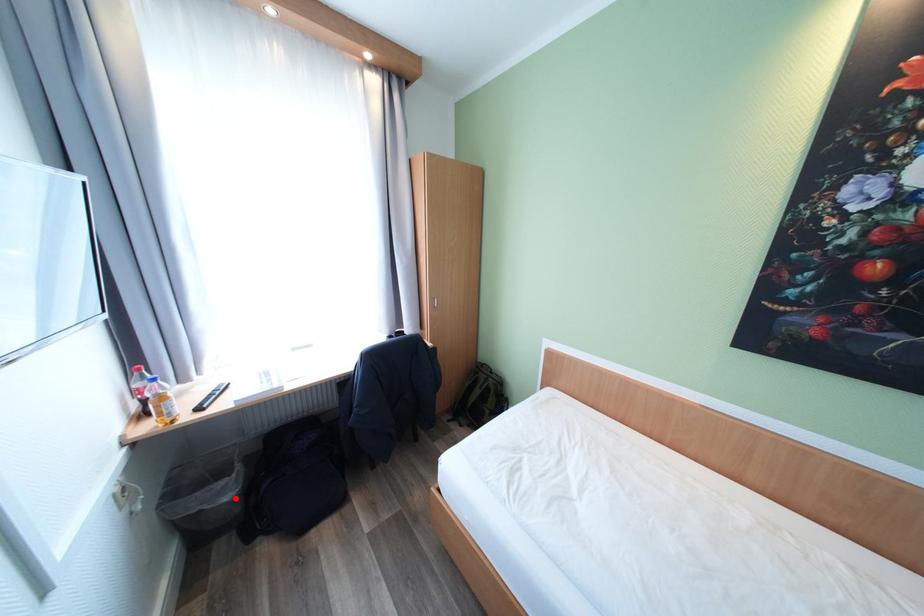
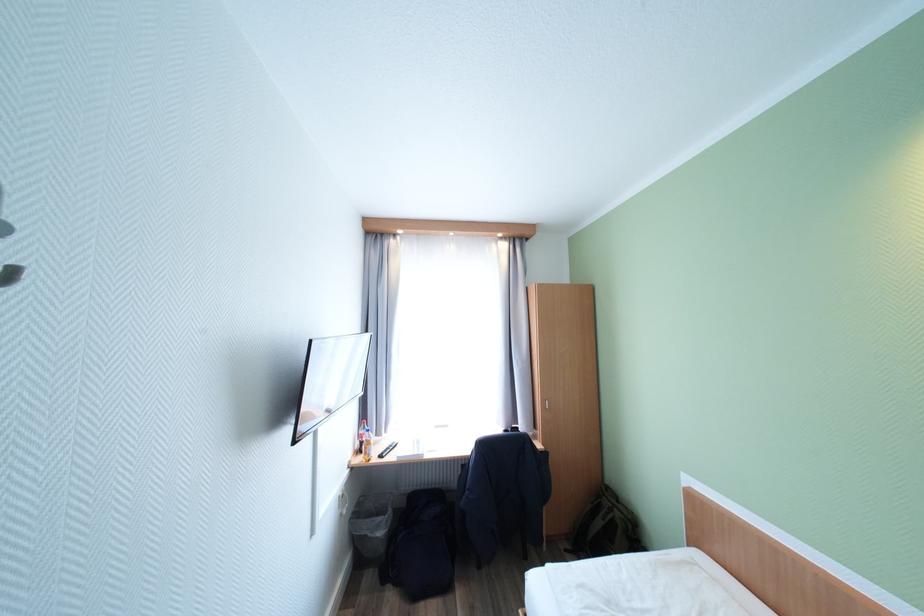
Find the pixel in the second image that matches the highlighted location in the first image.

(387, 535)